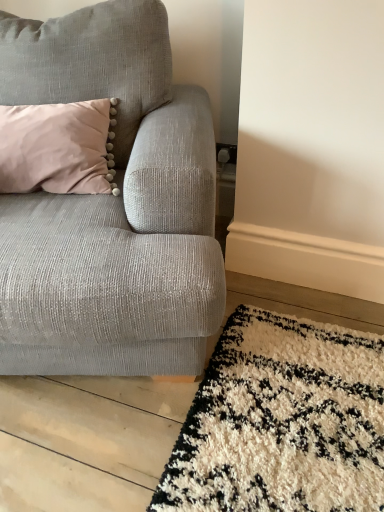
Measure the distance between point (21, 20) and camera.

The depth of point (21, 20) is 4.29 feet.

The height and width of the screenshot is (512, 384). What do you see at coordinates (112, 207) in the screenshot?
I see `textured gray couch at left` at bounding box center [112, 207].

Locate an element on the screen. Image resolution: width=384 pixels, height=512 pixels. textured gray couch at left is located at coordinates (112, 207).

This screenshot has width=384, height=512. Identify the location of textured gray couch at left. (112, 207).